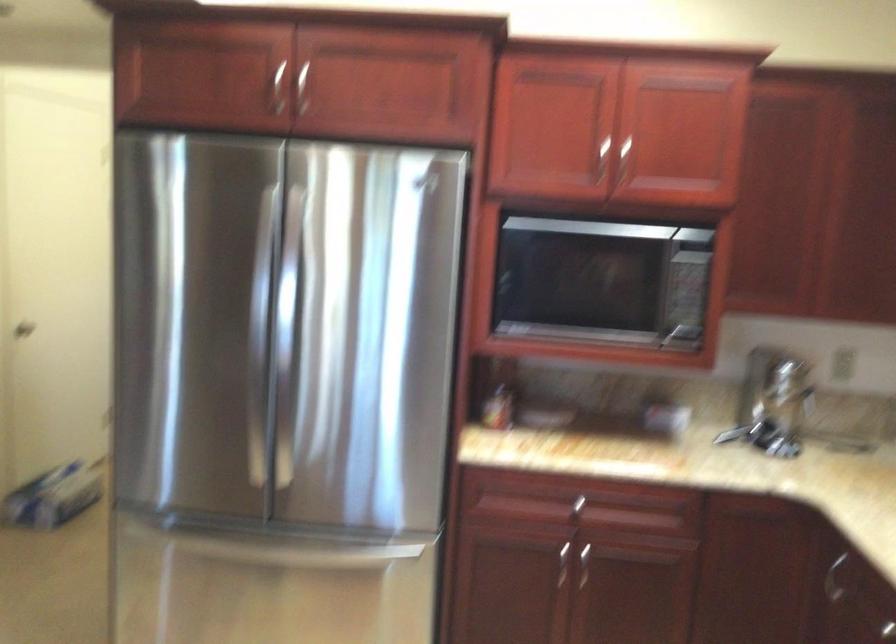
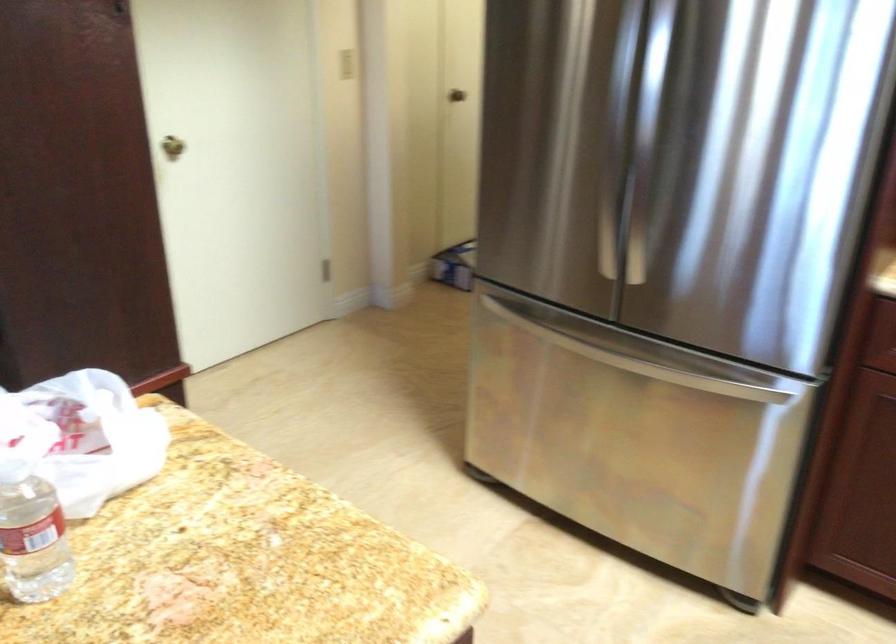
Question: I am providing you with two images of the same scene from different viewpoints. Which of the following objects are not visible in image2?

Choices:
 (A) white light switch
 (B) brass door knob
 (C) stainless steel freezer handle
 (D) none of these

Answer: (D)